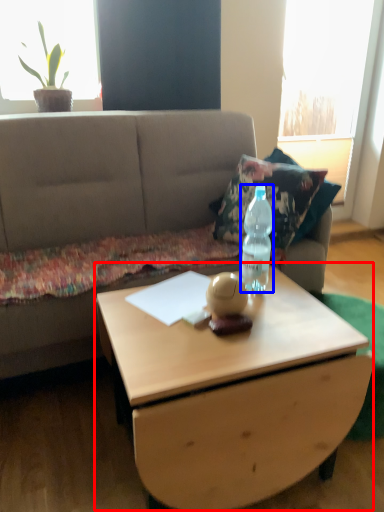
Question: Which object appears closest to the camera in this image, coffee table (highlighted by a red box) or bottle (highlighted by a blue box)?

Choices:
 (A) coffee table
 (B) bottle

Answer: (A)